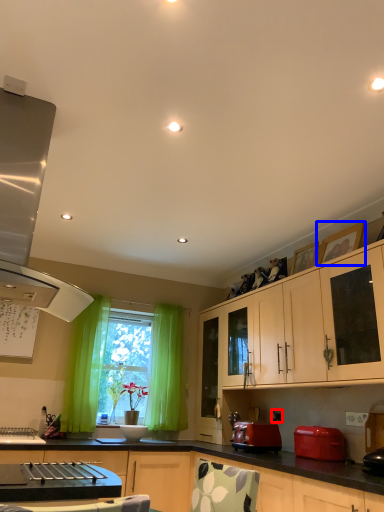
Question: Which object appears farthest to the camera in this image, power outlet (highlighted by a red box) or picture frame (highlighted by a blue box)?

Choices:
 (A) power outlet
 (B) picture frame

Answer: (A)